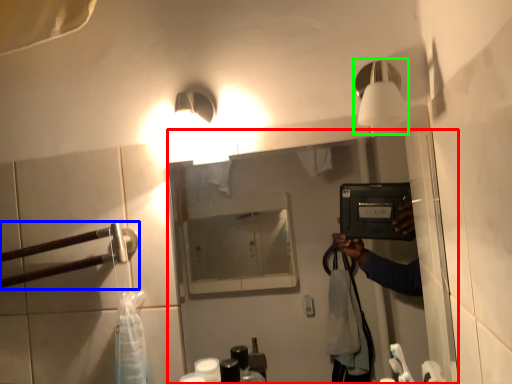
Question: Considering the real-world distances, which object is closest to mirror (highlighted by a red box)? door handle (highlighted by a blue box) or light fixture (highlighted by a green box).

Choices:
 (A) door handle
 (B) light fixture

Answer: (A)